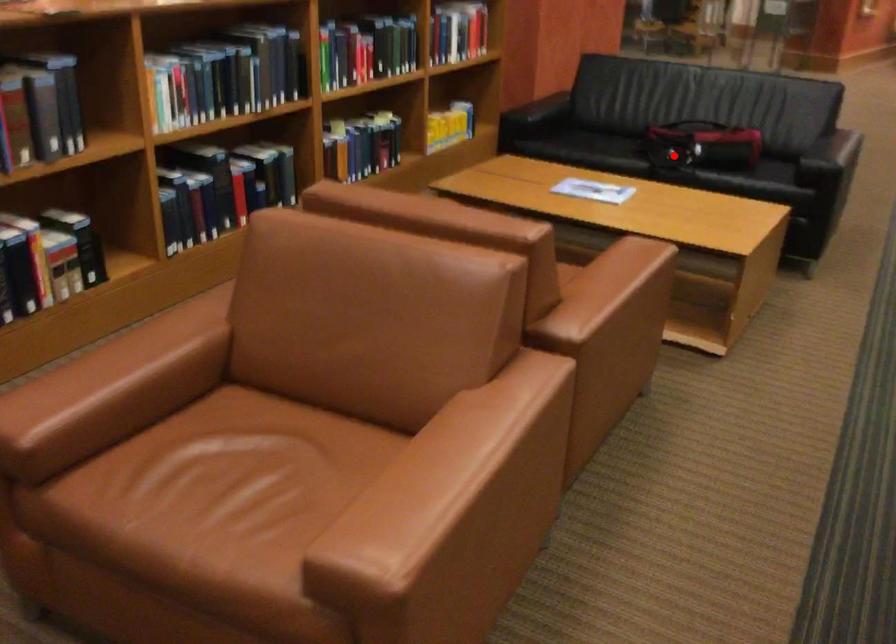
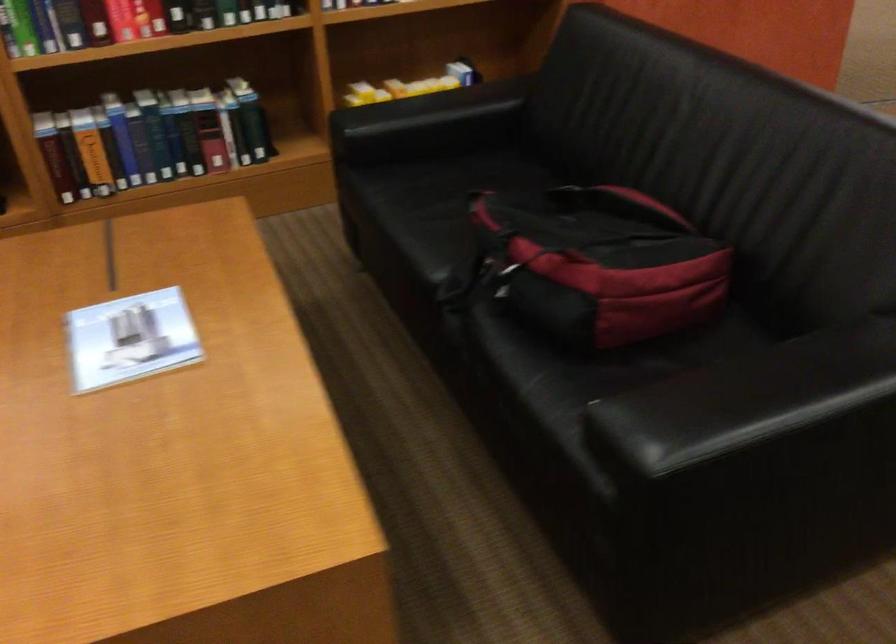
Question: I am providing you with two images of the same scene from different viewpoints. A red point is shown in image1. For the corresponding object point in image2, is it positioned nearer or farther from the camera?

Choices:
 (A) Nearer
 (B) Farther

Answer: (A)